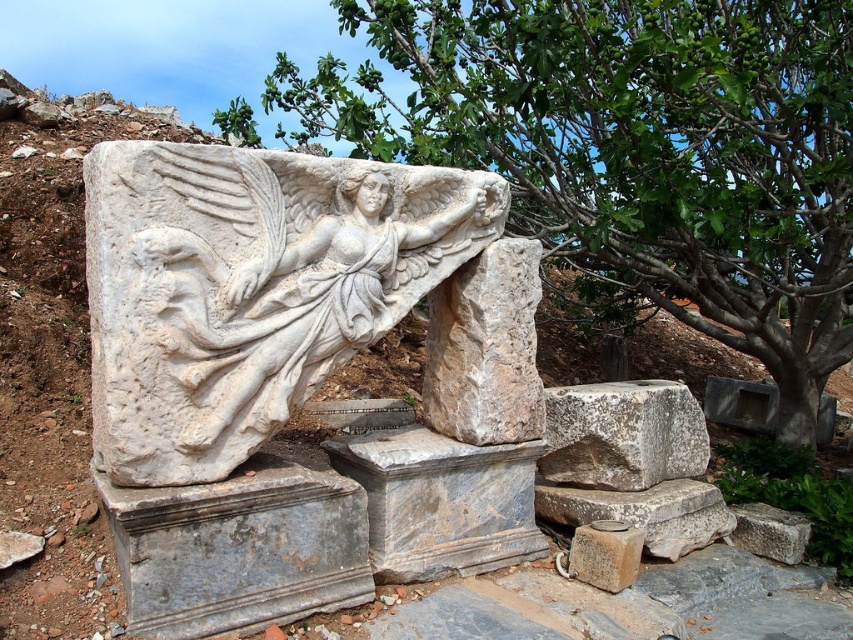
Can you confirm if white marble sculpture at center is taller than smooth gray stone at lower center?

Yes.

Where is `white marble sculpture at center`? Image resolution: width=853 pixels, height=640 pixels. white marble sculpture at center is located at coordinates (248, 288).

Is point (392, 40) less distant than point (791, 550)?

That is False.

The width and height of the screenshot is (853, 640). What do you see at coordinates (635, 150) in the screenshot? I see `green leafy tree at upper center` at bounding box center [635, 150].

The image size is (853, 640). In order to click on green leafy tree at upper center in this screenshot , I will do (x=635, y=150).

Is white marble sculpture at center bigger than gray rough stone at lower right?

Indeed, white marble sculpture at center has a larger size compared to gray rough stone at lower right.

Which is behind, point (242, 433) or point (791, 548)?

The point (791, 548) is behind.

Is point (180, 440) positioned before point (747, 536)?

Yes, point (180, 440) is closer to viewer.

Where is `white marble sculpture at center`? The height and width of the screenshot is (640, 853). white marble sculpture at center is located at coordinates tap(248, 288).